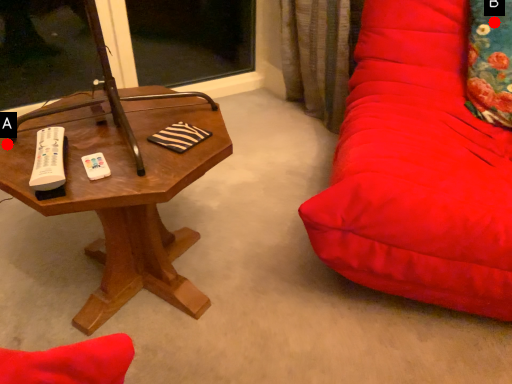
Question: Two points are circled on the image, labeled by A and B beside each circle. Which point is farther from the camera taking this photo?

Choices:
 (A) A is further
 (B) B is further

Answer: (B)